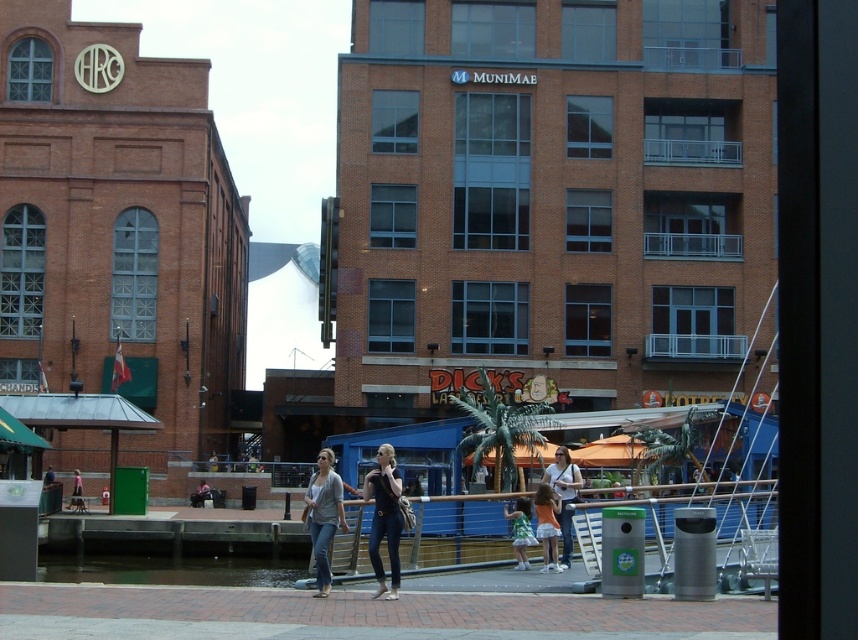
Does denim jeans at center appear on the right side of matte white shirt at center?

Incorrect, denim jeans at center is not on the right side of matte white shirt at center.

Who is shorter, denim jeans at center or matte white shirt at center?

matte white shirt at center is shorter.

Is point (327, 474) behind point (565, 541)?

No, (327, 474) is closer to viewer.

Identify the location of denim jeans at center. The image size is (858, 640). (323, 515).

Is clear water at lower center positioned at the back of denim jeans at center?

Yes, clear water at lower center is behind denim jeans at center.

This screenshot has width=858, height=640. Describe the element at coordinates (170, 570) in the screenshot. I see `clear water at lower center` at that location.

Is point (113, 573) closer to camera compared to point (328, 520)?

No, (113, 573) is further to viewer.

You are a GUI agent. You are given a task and a screenshot of the screen. Output one action in this format:
    pyautogui.click(x=<x>, y=<y>)
    Task: Click on the clear water at lower center
    This screenshot has width=858, height=640.
    Given the screenshot: What is the action you would take?
    pyautogui.click(x=170, y=570)

In the scene shown: Does clear water at lower center appear on the right side of matte white shirt at center?

Incorrect, clear water at lower center is not on the right side of matte white shirt at center.

Is clear water at lower center wider than matte white shirt at center?

Yes, clear water at lower center is wider than matte white shirt at center.

In order to click on clear water at lower center in this screenshot , I will do `click(170, 570)`.